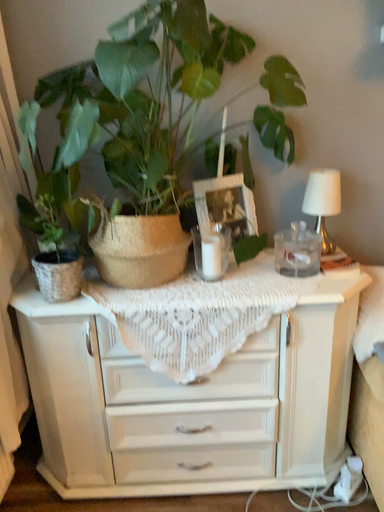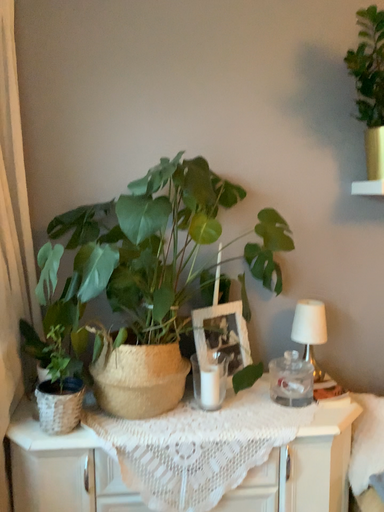
Question: Which way did the camera rotate in the video?

Choices:
 (A) rotated upward
 (B) rotated downward

Answer: (A)